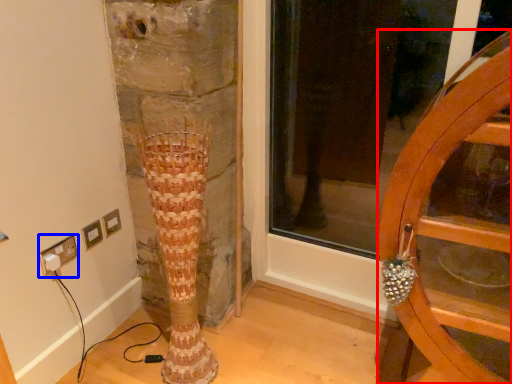
Question: Which of the following is the farthest to the observer, furniture (highlighted by a red box) or electric outlet (highlighted by a blue box)?

Choices:
 (A) furniture
 (B) electric outlet

Answer: (B)